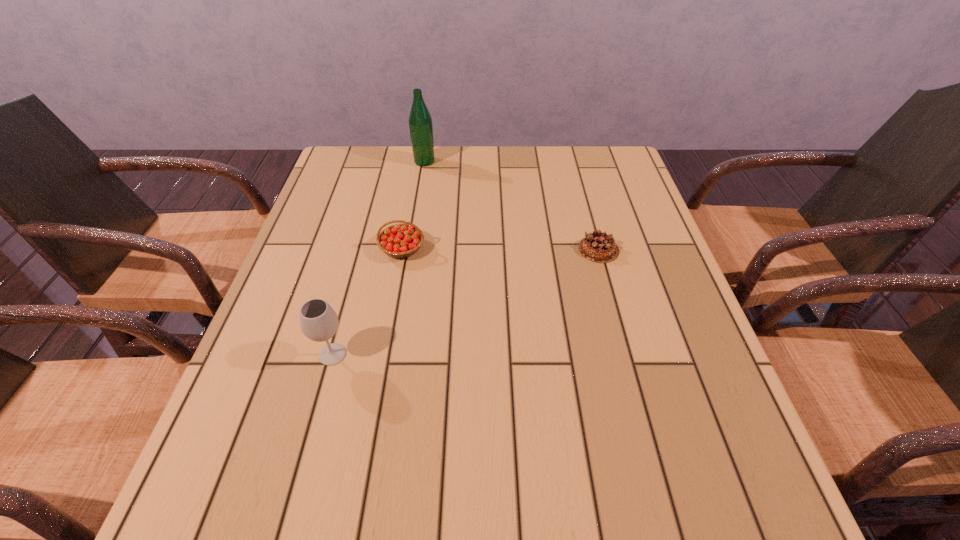
Identify the location of empty location between the third tallest object and the chocolate cake. (500, 249).

Locate an element on the screen. This screenshot has height=540, width=960. unoccupied position between the third tallest object and the tallest object is located at coordinates (413, 205).

At what (x,y) coordinates should I click in order to perform the action: click on vacant space that's between the bottle and the third shortest object. Please return your answer as a coordinate pair (x, y). The image size is (960, 540). Looking at the image, I should click on (378, 258).

Where is `unoccupied area between the second shortest object and the nearest object`? unoccupied area between the second shortest object and the nearest object is located at coordinates (368, 301).

Identify the location of vacant area that lies between the farthest object and the wineglass. pyautogui.click(x=378, y=258).

In order to click on free space between the tallest object and the strawberry in this screenshot , I will do `click(413, 205)`.

You are a GUI agent. You are given a task and a screenshot of the screen. Output one action in this format:
    pyautogui.click(x=<x>, y=<y>)
    Task: Click on the free space between the shortest object and the strawberry
    The image size is (960, 540).
    Given the screenshot: What is the action you would take?
    pyautogui.click(x=500, y=249)

At what (x,y) coordinates should I click in order to perform the action: click on vacant point located between the bottle and the strawberry. Please return your answer as a coordinate pair (x, y). This screenshot has width=960, height=540. Looking at the image, I should click on (413, 205).

Find the location of `unoccupied position between the wineglass and the rightmost object`. unoccupied position between the wineglass and the rightmost object is located at coordinates (466, 302).

Locate which object ranks second in proximity to the strawberry. Please provide its 2D coordinates. Your answer should be formatted as a tuple, i.e. [(x, y)], where the tuple contains the x and y coordinates of a point satisfying the conditions above.

[(420, 122)]